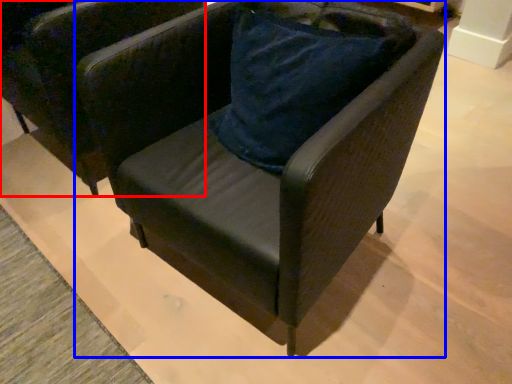
Question: Which object is closer to the camera taking this photo, chair (highlighted by a red box) or chair (highlighted by a blue box)?

Choices:
 (A) chair
 (B) chair

Answer: (B)